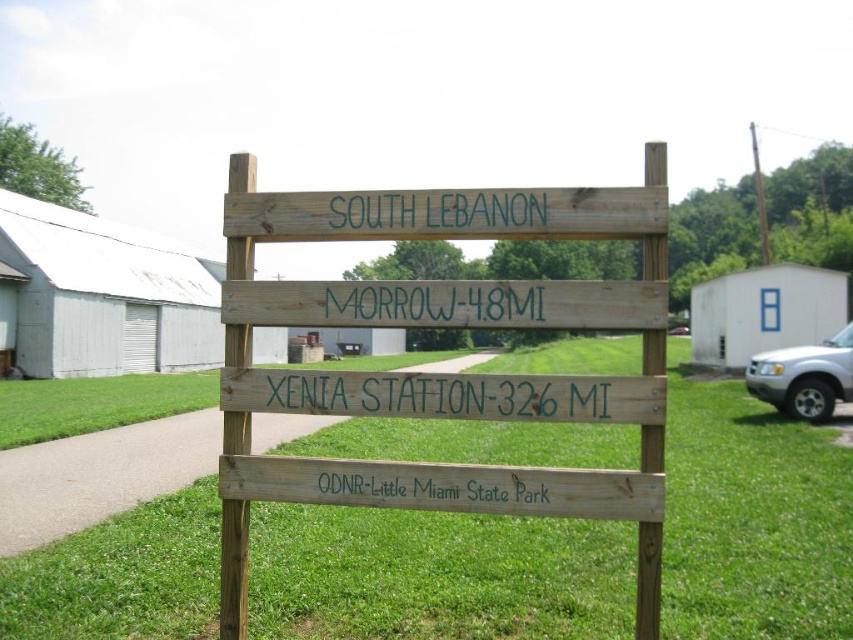
Question: Is natural wood sign at center further to the viewer compared to green painted wood sign at center?

Choices:
 (A) no
 (B) yes

Answer: (A)

Question: Among these points, which one is farthest from the camera?

Choices:
 (A) (283, 381)
 (B) (500, 205)
 (C) (711, 522)

Answer: (C)

Question: Among these objects, which one is farthest from the camera?

Choices:
 (A) green painted wood sign at upper center
 (B) green grass at center
 (C) green wood odnr-little miami state park at center
 (D) green wood sign at center

Answer: (A)

Question: Is green painted wood sign at center further to the viewer compared to green painted wood sign at upper center?

Choices:
 (A) no
 (B) yes

Answer: (A)

Question: Is natural wood sign at center behind green painted wood sign at upper center?

Choices:
 (A) no
 (B) yes

Answer: (A)

Question: Which point appears closest to the camera in this image?

Choices:
 (A) (387, 285)
 (B) (231, 529)

Answer: (A)